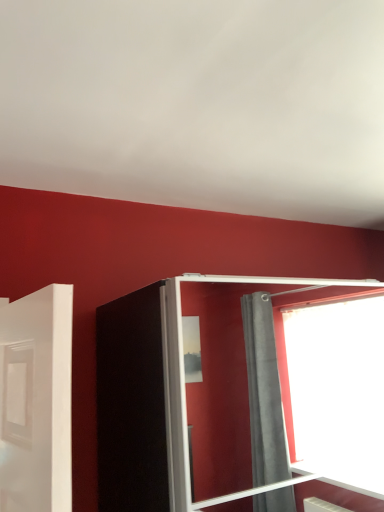
What do you see at coordinates (181, 387) in the screenshot? I see `transparent glass door at center` at bounding box center [181, 387].

The height and width of the screenshot is (512, 384). In order to click on transparent glass door at center in this screenshot , I will do `click(181, 387)`.

This screenshot has height=512, width=384. I want to click on transparent glass door at center, so click(x=181, y=387).